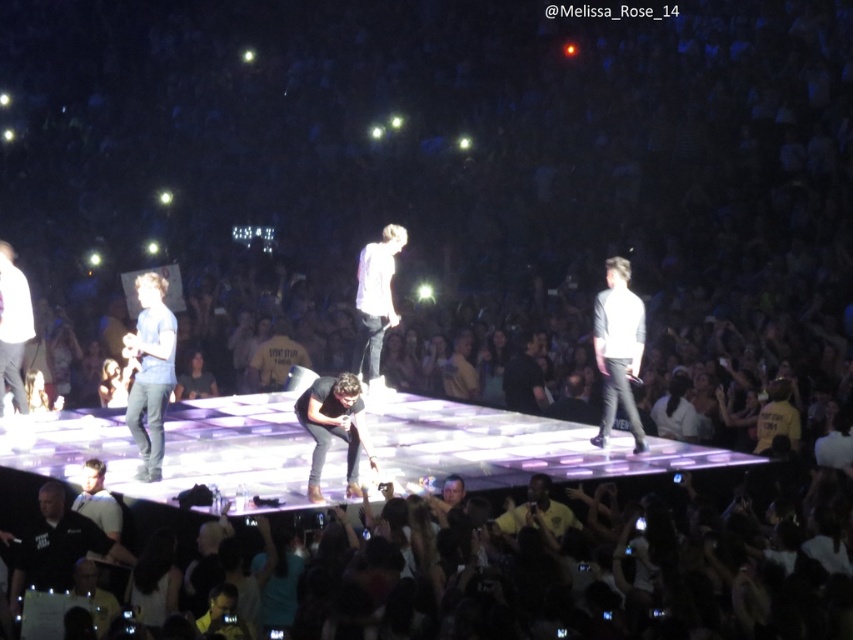
You are a photographer trying to capture a photo of the white matte shirt at center and the black shirt at lower left during the concert. Which performer should you focus on first to ensure they are in sharp focus?

The black shirt at lower left is closer to the viewer than the white matte shirt at center, so you should focus on the black shirt at lower left first to ensure it is in sharp focus.

You are a photographer trying to capture both the white matte shirt at right and the black shirt at lower left in a single shot. Which performer should you focus on first to ensure they are in sharp focus?

The white matte shirt at right is further to the viewer than the black shirt at lower left. To ensure both are in focus, you should focus on the white matte shirt at right first since it is closer and adjusting focus from close to far is easier.

You are a photographer at the concert and want to capture both the white matte shirt at right and the black shirt at lower left in a single frame. Based on their positions, which shirt should you focus on first to ensure both are in the shot?

The white matte shirt at right is located above the black shirt at lower left, so you should focus on the black shirt at lower left first to ensure both are in the shot.